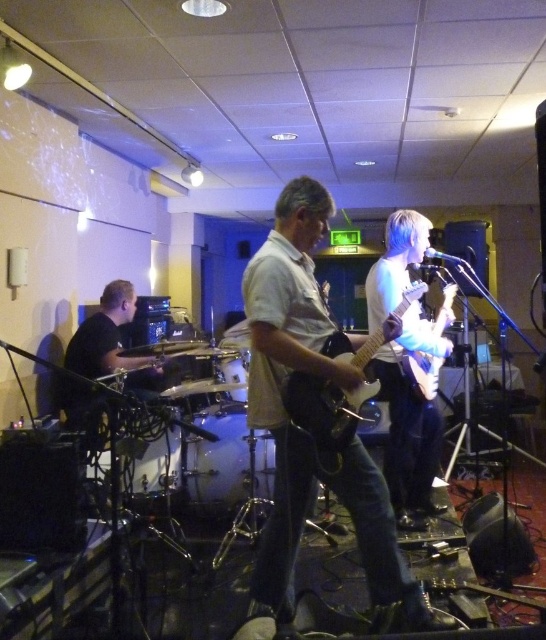
You are a stagehand preparing to move equipment. You need to place a 1.5 meter long banner between the white glossy electric guitar at center and the white drum at center. Is there enough space for the banner?

The white glossy electric guitar at center and white drum at center are 1.23 meters apart. Since the banner is 1.5 meters long, which is longer than the space between them, there isn not enough space to place the banner between them.

You are a photographer at the live music performance and want to capture a closeup shot of the electric guitarist. You have two points marked in the image for focus. Which point, point 1 at coordinates point [400,355] or point 2 at coordinates point [236,390], is closer to the electric guitarist and thus better for focusing?

Point 1 at coordinates point [400,355] is closer to the electric guitarist and thus better for focusing because it is closer to the viewer than point 2 at coordinates point [236,390].

You are a stagehand setting up for a live music performance. You need to place a new amplifier that must be positioned exactly at point 0.725, 0.401. Is the clear glass drum at center currently occupying that location?

Yes, the clear glass drum at center is located at point [218,464], so it is currently occupying that location.